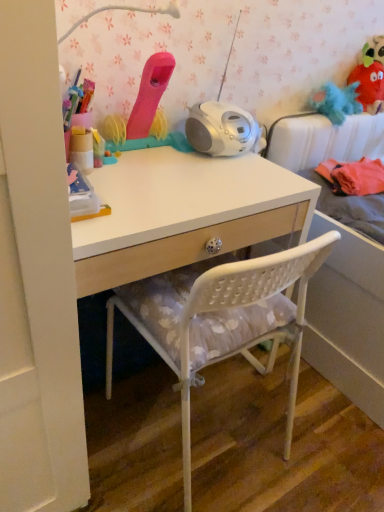
Locate an element on the screen. This screenshot has height=512, width=384. vacant region below white plastic chair at center (from a real-world perspective) is located at coordinates (210, 448).